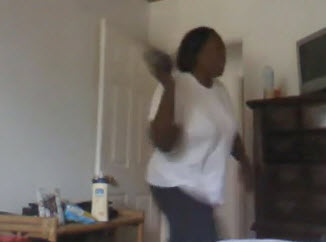
Locate an element on the screen. The image size is (326, 242). table is located at coordinates (116, 219).